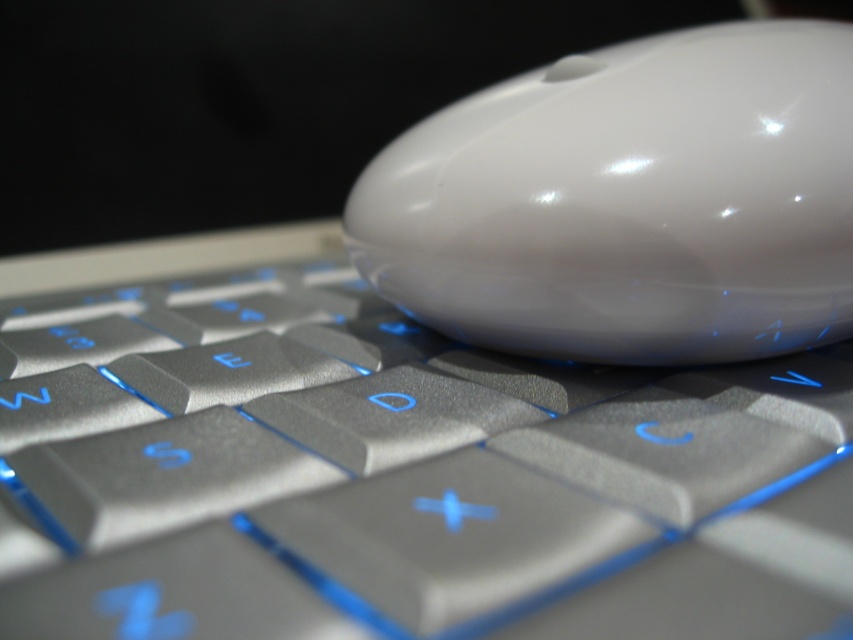
The height and width of the screenshot is (640, 853). Find the location of `satin silver keyboard at center`. satin silver keyboard at center is located at coordinates (393, 474).

Does satin silver keyboard at center appear under white glossy mouse at upper center?

Yes.

Which is in front, point (363, 621) or point (456, 308)?

Point (363, 621)

Identify the location of satin silver keyboard at center. This screenshot has height=640, width=853. (393, 474).